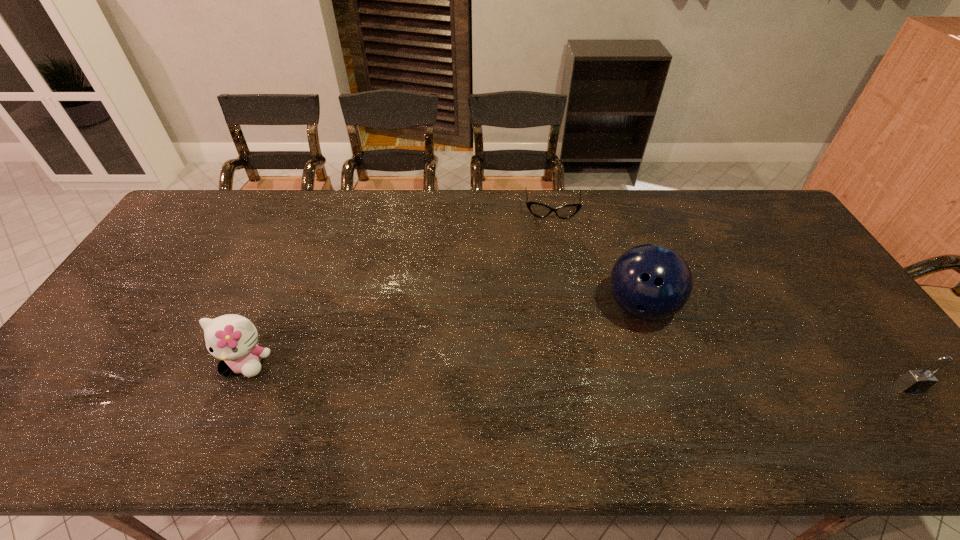
This screenshot has height=540, width=960. In order to click on vacant space located on the surface of the second farthest object near the finger holes in this screenshot , I will do `click(651, 397)`.

At what (x,y) coordinates should I click in order to perform the action: click on free space located 0.130m on the surface of the second farthest object near the finger holes. Please return your answer as a coordinate pair (x, y). Looking at the image, I should click on (649, 379).

At what (x,y) coordinates should I click in order to perform the action: click on vacant space located 0.130m on the front-facing side of the spectacles. Please return your answer as a coordinate pair (x, y). Looking at the image, I should click on (553, 246).

Image resolution: width=960 pixels, height=540 pixels. I want to click on free space located 0.260m on the front-facing side of the spectacles, so click(554, 275).

At what (x,y) coordinates should I click in order to perform the action: click on free space located 0.100m on the front-facing side of the spectacles. Please return your answer as a coordinate pair (x, y). This screenshot has height=540, width=960. Looking at the image, I should click on (553, 240).

Identify the location of object at the far edge. This screenshot has height=540, width=960. (539, 210).

Locate an element on the screen. This screenshot has height=540, width=960. kitten that is at the near edge is located at coordinates (232, 338).

Locate an element on the screen. The width and height of the screenshot is (960, 540). padlock located at the near edge is located at coordinates (914, 381).

Identify the location of object that is at the right edge. Image resolution: width=960 pixels, height=540 pixels. (914, 381).

Where is `object at the near right corner`? This screenshot has width=960, height=540. object at the near right corner is located at coordinates 914,381.